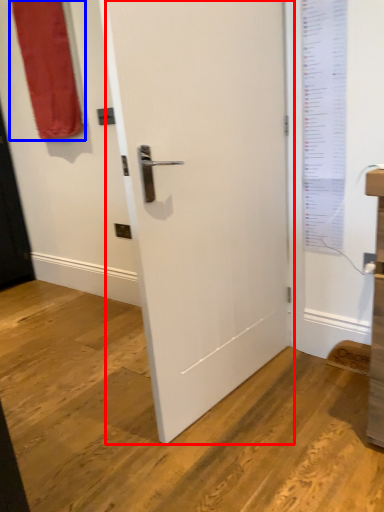
Question: Among these objects, which one is nearest to the camera, door (highlighted by a red box) or curtain (highlighted by a blue box)?

Choices:
 (A) door
 (B) curtain

Answer: (A)